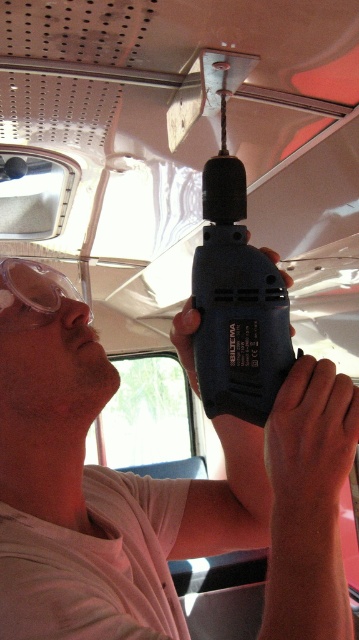
Question: Is black plastic drill at center below clear plastic goggles at left?

Choices:
 (A) no
 (B) yes

Answer: (A)

Question: Which object is the farthest from the clear plastic goggles at left?

Choices:
 (A) black plastic drill at center
 (B) matte black drill at upper center

Answer: (B)

Question: Estimate the real-world distances between objects in this image. Which object is closer to the black plastic drill at center?

Choices:
 (A) matte black drill at upper center
 (B) clear plastic goggles at left

Answer: (A)

Question: Does matte black drill at upper center have a greater width compared to clear plastic goggles at left?

Choices:
 (A) no
 (B) yes

Answer: (B)

Question: Does black plastic drill at center appear under clear plastic goggles at left?

Choices:
 (A) yes
 (B) no

Answer: (B)

Question: Which object appears farthest from the camera in this image?

Choices:
 (A) black plastic drill at center
 (B) matte black drill at upper center

Answer: (A)